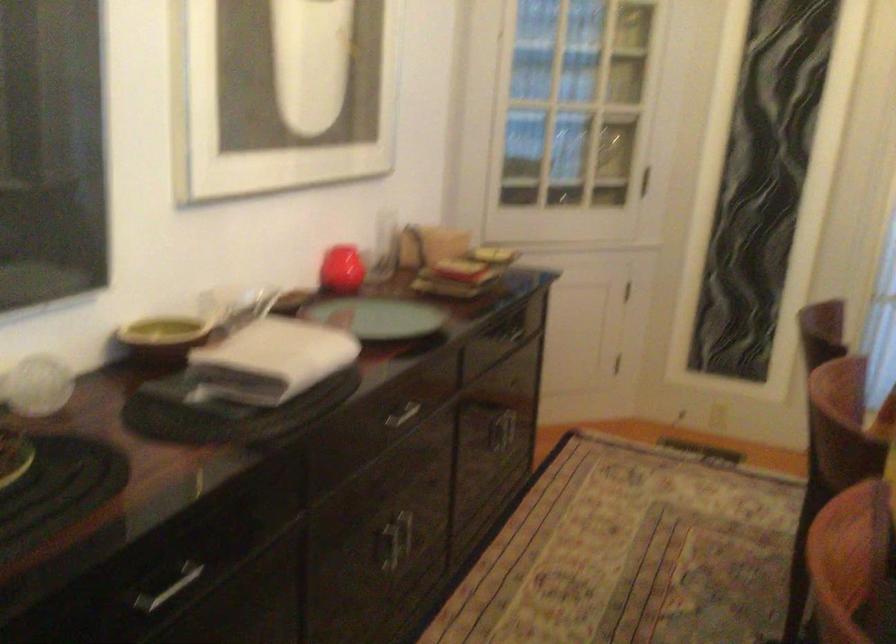
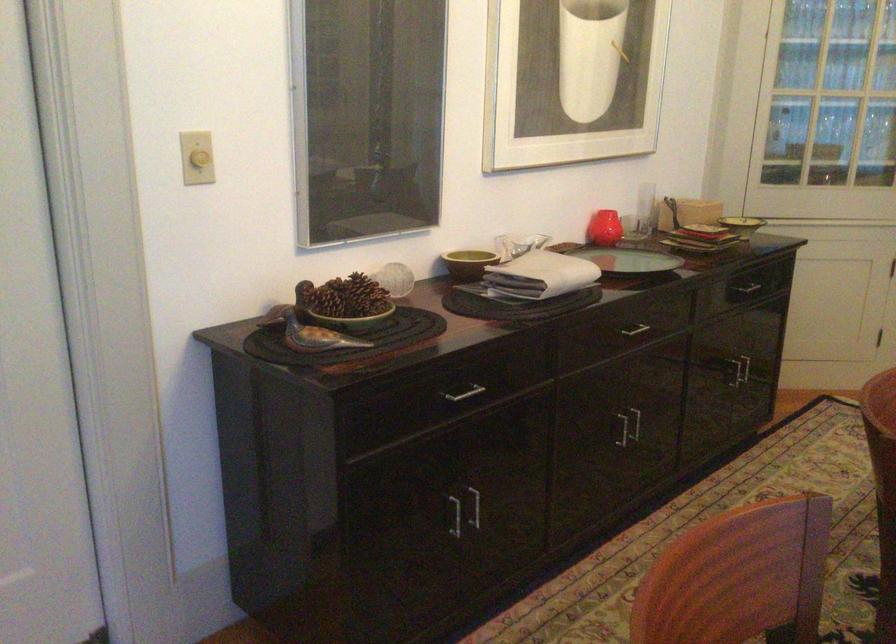
The point at [170,343] is marked in the first image. Where is the corresponding point in the second image?

(468, 263)